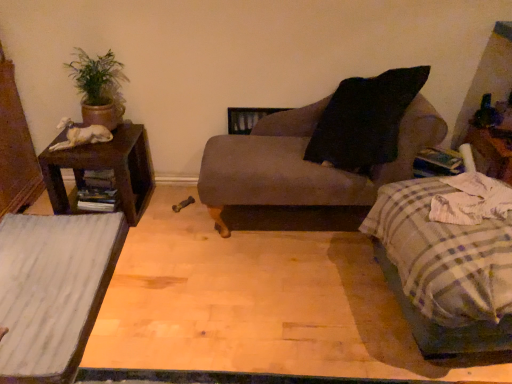
I want to click on free spot above brown wood nightstand at left (from a real-world perspective), so click(98, 140).